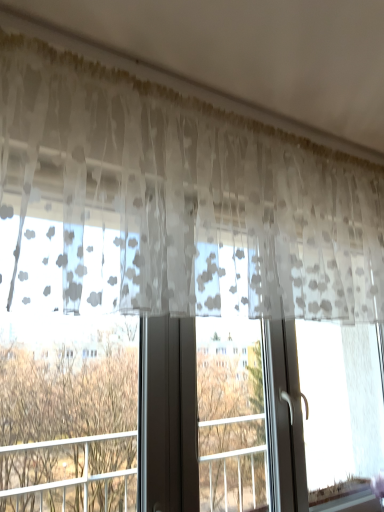
This screenshot has width=384, height=512. What do you see at coordinates (67, 417) in the screenshot?
I see `brown leafy tree at left` at bounding box center [67, 417].

Where is `brown leafy tree at left`? brown leafy tree at left is located at coordinates (67, 417).

From the picture: What is the approximate width of transparent floral-patterned curtain at upper center?

It is 11.47 inches.

Identify the location of transparent floral-patterned curtain at upper center. The width and height of the screenshot is (384, 512). (186, 193).

This screenshot has width=384, height=512. What do you see at coordinates (186, 193) in the screenshot?
I see `transparent floral-patterned curtain at upper center` at bounding box center [186, 193].

Find the location of `brown leafy tree at left`. brown leafy tree at left is located at coordinates (67, 417).

Is brown leafy tree at left to the left or to the right of transparent floral-patterned curtain at upper center in the image?

From the image, it's evident that brown leafy tree at left is to the left of transparent floral-patterned curtain at upper center.

Considering the positions of objects brown leafy tree at left and transparent floral-patterned curtain at upper center in the image provided, who is in front, brown leafy tree at left or transparent floral-patterned curtain at upper center?

Positioned in front is transparent floral-patterned curtain at upper center.

Does point (5, 408) lie behind point (304, 242)?

No.

From the image's perspective, is brown leafy tree at left on transparent floral-patterned curtain at upper center?

Actually, brown leafy tree at left appears below transparent floral-patterned curtain at upper center in the image.

From a real-world perspective, is brown leafy tree at left physically located above or below transparent floral-patterned curtain at upper center?

brown leafy tree at left is below transparent floral-patterned curtain at upper center.

Consider the image. Considering the relative sizes of brown leafy tree at left and transparent floral-patterned curtain at upper center in the image provided, is brown leafy tree at left thinner than transparent floral-patterned curtain at upper center?

Indeed, brown leafy tree at left has a lesser width compared to transparent floral-patterned curtain at upper center.

Considering the sizes of objects brown leafy tree at left and transparent floral-patterned curtain at upper center in the image provided, who is taller, brown leafy tree at left or transparent floral-patterned curtain at upper center?

Standing taller between the two is transparent floral-patterned curtain at upper center.

Considering the relative sizes of brown leafy tree at left and transparent floral-patterned curtain at upper center in the image provided, is brown leafy tree at left bigger than transparent floral-patterned curtain at upper center?

Incorrect, brown leafy tree at left is not larger than transparent floral-patterned curtain at upper center.

Is brown leafy tree at left completely or partially outside of transparent floral-patterned curtain at upper center?

Yes, brown leafy tree at left is outside of transparent floral-patterned curtain at upper center.

In the scene shown: Is brown leafy tree at left not near transparent floral-patterned curtain at upper center?

No.

In the scene shown: Could you tell me if brown leafy tree at left is turned towards transparent floral-patterned curtain at upper center?

No, brown leafy tree at left is not facing towards transparent floral-patterned curtain at upper center.

Where is `tree on the left of transparent floral-patterned curtain at upper center`? The width and height of the screenshot is (384, 512). tree on the left of transparent floral-patterned curtain at upper center is located at coordinates (67, 417).

Considering the positions of objects transparent floral-patterned curtain at upper center and brown leafy tree at left in the image provided, who is more to the right, transparent floral-patterned curtain at upper center or brown leafy tree at left?

transparent floral-patterned curtain at upper center.

Is transparent floral-patterned curtain at upper center further to camera compared to brown leafy tree at left?

That is False.

Between point (40, 85) and point (8, 445), which one is positioned in front?

The point (40, 85) is more forward.

Consider the image. From the image's perspective, is transparent floral-patterned curtain at upper center under brown leafy tree at left?

No, from the image's perspective, transparent floral-patterned curtain at upper center is not beneath brown leafy tree at left.

From a real-world perspective, is transparent floral-patterned curtain at upper center physically located above or below brown leafy tree at left?

Clearly, from a real-world perspective, transparent floral-patterned curtain at upper center is above brown leafy tree at left.

In the scene shown: Can you confirm if transparent floral-patterned curtain at upper center is thinner than brown leafy tree at left?

In fact, transparent floral-patterned curtain at upper center might be wider than brown leafy tree at left.

Who is shorter, transparent floral-patterned curtain at upper center or brown leafy tree at left?

brown leafy tree at left.

Considering the sizes of objects transparent floral-patterned curtain at upper center and brown leafy tree at left in the image provided, who is smaller, transparent floral-patterned curtain at upper center or brown leafy tree at left?

With smaller size is brown leafy tree at left.

Do you think transparent floral-patterned curtain at upper center is within brown leafy tree at left, or outside of it?

transparent floral-patterned curtain at upper center is located beyond the bounds of brown leafy tree at left.

Are transparent floral-patterned curtain at upper center and brown leafy tree at left located far from each other?

No, transparent floral-patterned curtain at upper center is in close proximity to brown leafy tree at left.

Is transparent floral-patterned curtain at upper center facing away from brown leafy tree at left?

No, brown leafy tree at left is not at the back of transparent floral-patterned curtain at upper center.

The height and width of the screenshot is (512, 384). Find the location of `curtain above the brown leafy tree at left (from a real-world perspective)`. curtain above the brown leafy tree at left (from a real-world perspective) is located at coordinates (186, 193).

Locate an element on the screen. tree that appears behind the transparent floral-patterned curtain at upper center is located at coordinates (67, 417).

Image resolution: width=384 pixels, height=512 pixels. Identify the location of tree that is below the transparent floral-patterned curtain at upper center (from the image's perspective). (67, 417).